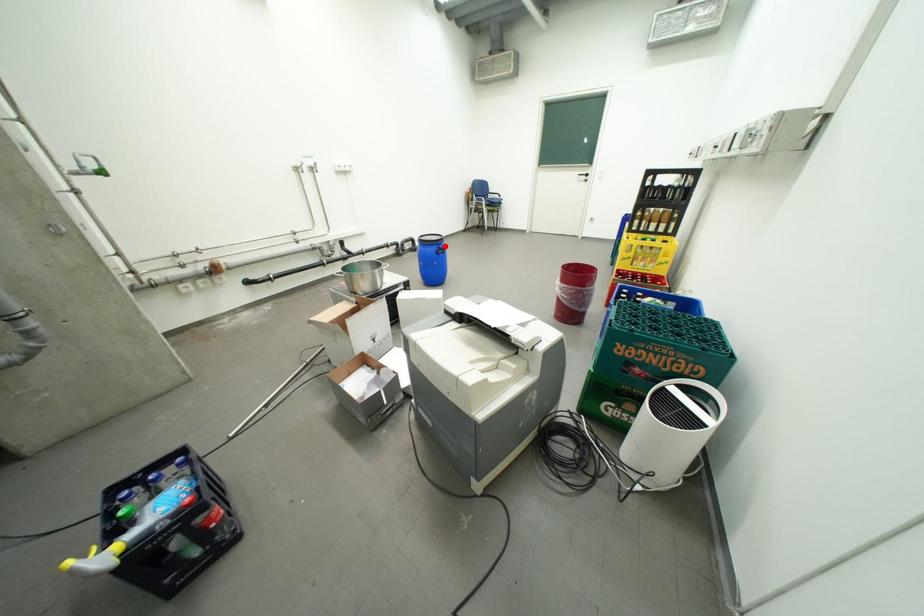
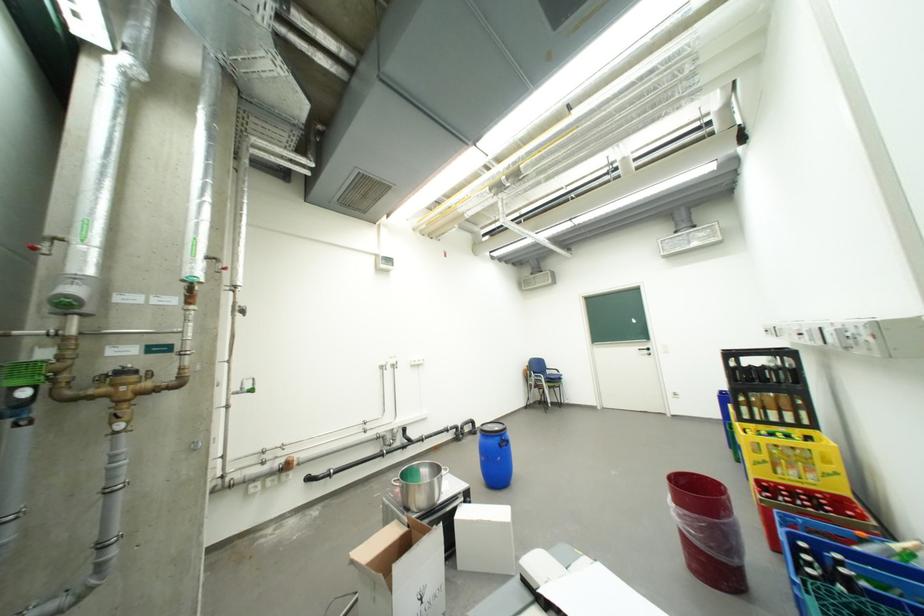
The point at the highlighted location is marked in the first image. Where is the corresponding point in the second image?

(507, 438)